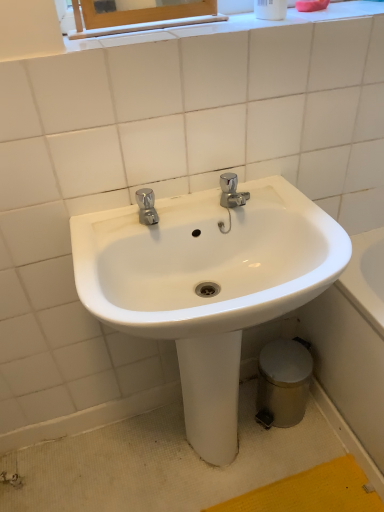
Identify the location of vacant space underneath white glossy sink at center (from a real-world perspective). (213, 464).